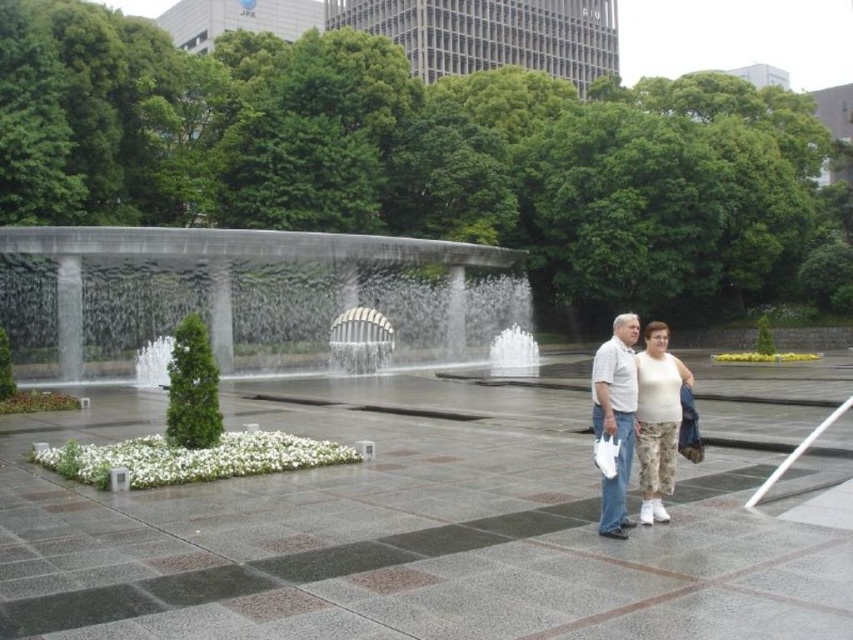
You are a photographer planning to capture the gray concrete waterfall at center and the white cotton tank top at lower right in a single shot. Considering their sizes, which object would you need to position closer to the camera to ensure both are visible in the frame?

The white cotton tank top at lower right is smaller than the gray concrete waterfall at center, so you should position the white cotton tank top at lower right closer to the camera to balance their sizes in the photo.

You are a photographer planning to take a portrait of two people wearing white cotton clothing. You notice the white cotton tank top at lower right and the white cotton shirt at center. Which clothing item is shorter in height?

The white cotton tank top at lower right has a lesser height compared to the white cotton shirt at center, so the white cotton tank top at lower right is shorter in height.

You are a photographer positioned at the edge of the paved area. You want to take a photo of the gray concrete waterfall at center and the white cotton tank top at lower right. Which object should you focus on first to ensure both are in the frame?

You should focus on the gray concrete waterfall at center first since it is closer to you than the white cotton tank top at lower right, ensuring both are in the frame.